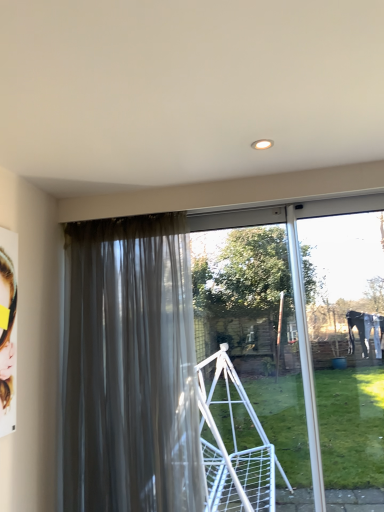
Question: Would you say clear glass screen door at center is part of satin gray curtain at left's contents?

Choices:
 (A) yes
 (B) no

Answer: (B)

Question: Is satin gray curtain at left positioned before clear glass screen door at center?

Choices:
 (A) no
 (B) yes

Answer: (B)

Question: Does satin gray curtain at left have a larger size compared to clear glass screen door at center?

Choices:
 (A) no
 (B) yes

Answer: (B)

Question: Is satin gray curtain at left oriented away from clear glass screen door at center?

Choices:
 (A) yes
 (B) no

Answer: (B)

Question: Is satin gray curtain at left at the left side of clear glass screen door at center?

Choices:
 (A) yes
 (B) no

Answer: (A)

Question: Considering the relative sizes of satin gray curtain at left and clear glass screen door at center in the image provided, is satin gray curtain at left wider than clear glass screen door at center?

Choices:
 (A) yes
 (B) no

Answer: (A)

Question: Is clear glass screen door at center further to the viewer compared to satin gray curtain at left?

Choices:
 (A) yes
 (B) no

Answer: (A)

Question: Is clear glass screen door at center touching satin gray curtain at left?

Choices:
 (A) yes
 (B) no

Answer: (B)

Question: From a real-world perspective, is clear glass screen door at center on top of satin gray curtain at left?

Choices:
 (A) no
 (B) yes

Answer: (A)

Question: Would you say clear glass screen door at center contains satin gray curtain at left?

Choices:
 (A) no
 (B) yes

Answer: (A)

Question: Is clear glass screen door at center located outside satin gray curtain at left?

Choices:
 (A) no
 (B) yes

Answer: (B)

Question: Does clear glass screen door at center appear on the left side of satin gray curtain at left?

Choices:
 (A) no
 (B) yes

Answer: (A)

Question: Considering the positions of satin gray curtain at left and clear glass screen door at center in the image, is satin gray curtain at left taller or shorter than clear glass screen door at center?

Choices:
 (A) short
 (B) tall

Answer: (B)